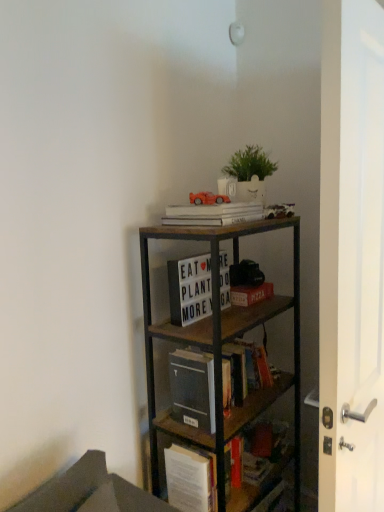
Question: Is white matte book at upper center, which ranks as the first book in top-to-bottom order, wider than matte cardboard book at center, which is the 2th book from bottom to top?

Choices:
 (A) yes
 (B) no

Answer: (A)

Question: Is the depth of white matte book at upper center, the fourth book positioned from the bottom, less than that of matte cardboard book at center, the third book when ordered from top to bottom?

Choices:
 (A) yes
 (B) no

Answer: (A)

Question: Is white matte book at upper center, which ranks as the first book in top-to-bottom order, oriented towards matte cardboard book at center, the third book when ordered from top to bottom?

Choices:
 (A) yes
 (B) no

Answer: (B)

Question: From the image's perspective, is white matte book at upper center, which ranks as the first book in top-to-bottom order, below matte cardboard book at center, which is the 2th book from bottom to top?

Choices:
 (A) no
 (B) yes

Answer: (A)

Question: Is white matte book at upper center, the fourth book positioned from the bottom, to the left of matte cardboard book at center, which is the 2th book from bottom to top, from the viewer's perspective?

Choices:
 (A) yes
 (B) no

Answer: (A)

Question: Is white matte book at upper center, the fourth book positioned from the bottom, at the right side of matte cardboard book at center, the third book when ordered from top to bottom?

Choices:
 (A) no
 (B) yes

Answer: (A)

Question: Is wooden bookcase at upper right wider than matte cardboard book at center, the third book when ordered from top to bottom?

Choices:
 (A) no
 (B) yes

Answer: (B)

Question: Is wooden bookcase at upper right far away from matte cardboard book at center, which is the 2th book from bottom to top?

Choices:
 (A) yes
 (B) no

Answer: (B)

Question: From the image's perspective, is wooden bookcase at upper right below matte cardboard book at center, the third book when ordered from top to bottom?

Choices:
 (A) yes
 (B) no

Answer: (A)

Question: Can you confirm if wooden bookcase at upper right is positioned to the left of matte cardboard book at center, the third book when ordered from top to bottom?

Choices:
 (A) yes
 (B) no

Answer: (A)

Question: Considering the relative sizes of wooden bookcase at upper right and matte cardboard book at center, which is the 2th book from bottom to top, in the image provided, is wooden bookcase at upper right taller than matte cardboard book at center, which is the 2th book from bottom to top,?

Choices:
 (A) no
 (B) yes

Answer: (B)

Question: Is wooden bookcase at upper right touching matte cardboard book at center, which is the 2th book from bottom to top?

Choices:
 (A) no
 (B) yes

Answer: (A)

Question: Considering the relative positions of white glossy door at right and white matte book at upper center, the fourth book positioned from the bottom, in the image provided, is white glossy door at right to the left of white matte book at upper center, the fourth book positioned from the bottom, from the viewer's perspective?

Choices:
 (A) no
 (B) yes

Answer: (A)